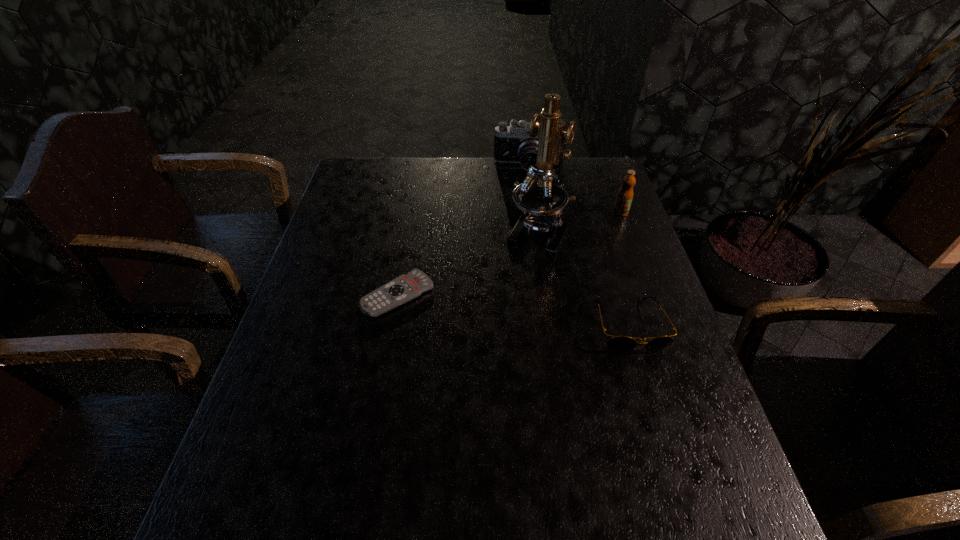
Find the location of a particular element. free space between the sunglasses and the orange juice is located at coordinates (625, 269).

This screenshot has width=960, height=540. Identify the location of vacant point located between the orange juice and the camera. (574, 190).

Image resolution: width=960 pixels, height=540 pixels. In order to click on empty location between the orange juice and the camera in this screenshot , I will do `click(574, 190)`.

I want to click on vacant area between the tallest object and the orange juice, so click(x=579, y=221).

Locate an element on the screen. The image size is (960, 540). free spot between the camera and the orange juice is located at coordinates (574, 190).

The image size is (960, 540). I want to click on unoccupied area between the remote control and the orange juice, so click(510, 254).

Where is `free spot between the orange juice and the shortest object`? free spot between the orange juice and the shortest object is located at coordinates (510, 254).

Locate an element on the screen. unoccupied position between the microscope and the orange juice is located at coordinates (579, 221).

Locate an element on the screen. The height and width of the screenshot is (540, 960). the fourth closest object to the microscope is located at coordinates (406, 287).

Find the location of a particular element. The image size is (960, 540). the third closest object relative to the sunglasses is located at coordinates (406, 287).